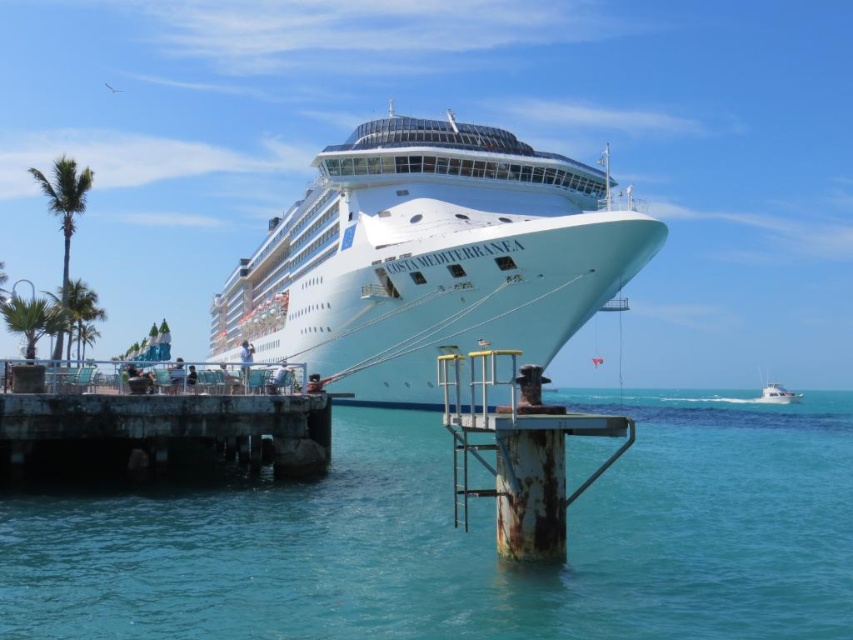
Question: Does white glossy cruise ship at center have a smaller size compared to white glossy boat at right?

Choices:
 (A) no
 (B) yes

Answer: (A)

Question: Can you confirm if clear blue water at lower left is wider than white glossy cruise ship at center?

Choices:
 (A) yes
 (B) no

Answer: (B)

Question: Which object is positioned farthest from the white glossy cruise ship at center?

Choices:
 (A) clear blue water at lower left
 (B) rusty metal dock at lower left
 (C) white glossy boat at right

Answer: (C)

Question: Can you confirm if rusty metal dock at lower left is smaller than white glossy boat at right?

Choices:
 (A) no
 (B) yes

Answer: (B)

Question: Which of the following is the farthest from the observer?

Choices:
 (A) [x=131, y=420]
 (B) [x=236, y=291]
 (C) [x=602, y=408]

Answer: (B)

Question: Based on their relative distances, which object is nearer to the white glossy boat at right?

Choices:
 (A) clear blue water at lower left
 (B) white glossy cruise ship at center
 (C) rusty metal dock at lower left

Answer: (B)